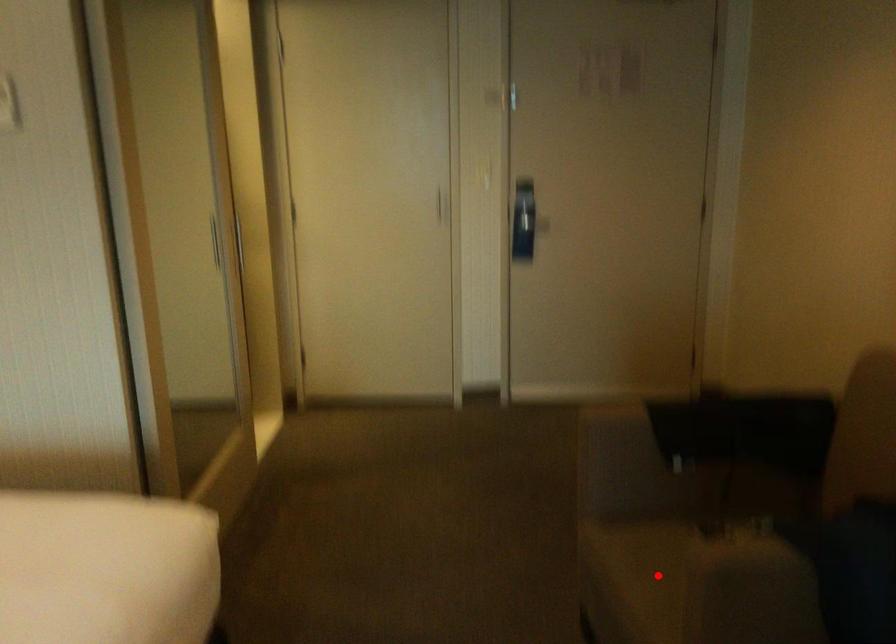
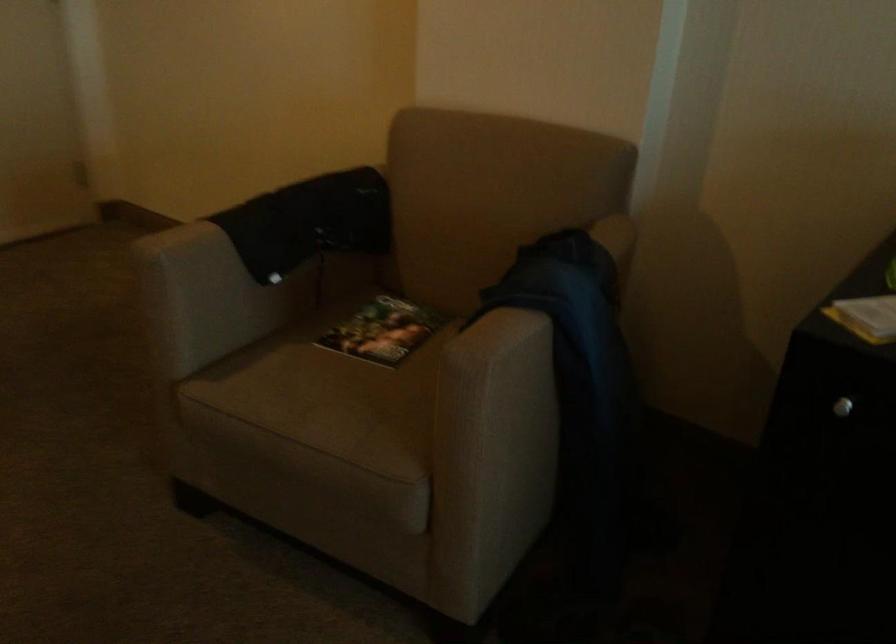
Question: I am providing you with two images of the same scene from different viewpoints. In image1, a red point is highlighted. Considering the same 3D point in image2, which of the following is correct?

Choices:
 (A) It is closer
 (B) It is farther

Answer: (A)